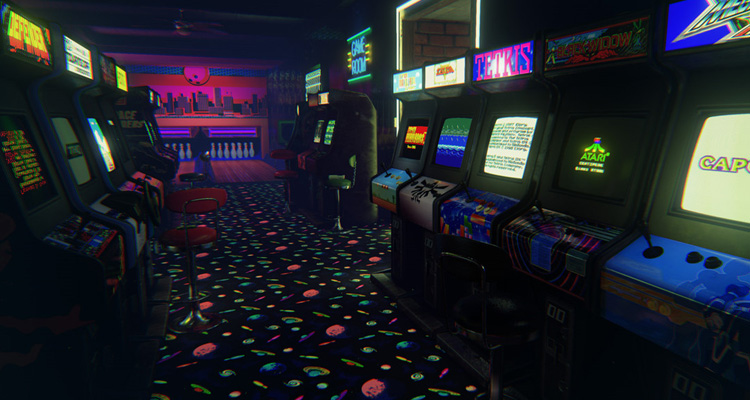
Locate an element on the screen. The width and height of the screenshot is (750, 400). zelda arcade cabinet is located at coordinates (436, 72).